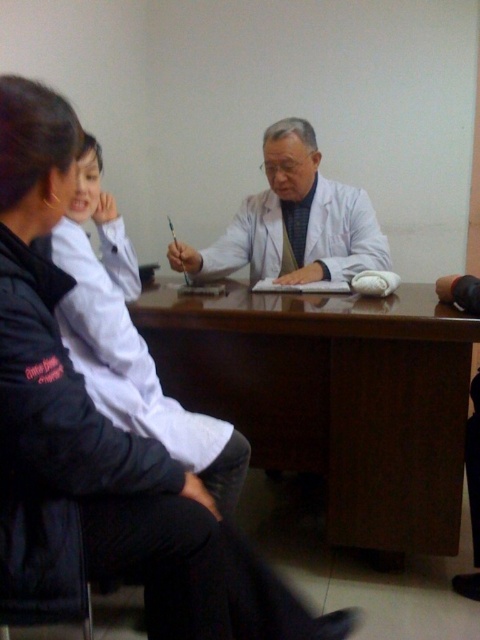
You are a delivery person who needs to place a small package between the brown wood table at center and the white matte coat at left. Can you fit it there?

The space between the brown wood table at center and the white matte coat at left is 15.23 inches, so yes, the small package can be placed there as it likely fits within that distance.

You are a patient entering the room and need to sit down immediately. The brown wood table at center and the white matte coat at center are in your path. Which object should you move out of the way first to reach the chair?

The white matte coat at center should be moved first because it is shorter than the brown wood table at center, making it easier to step over or around.